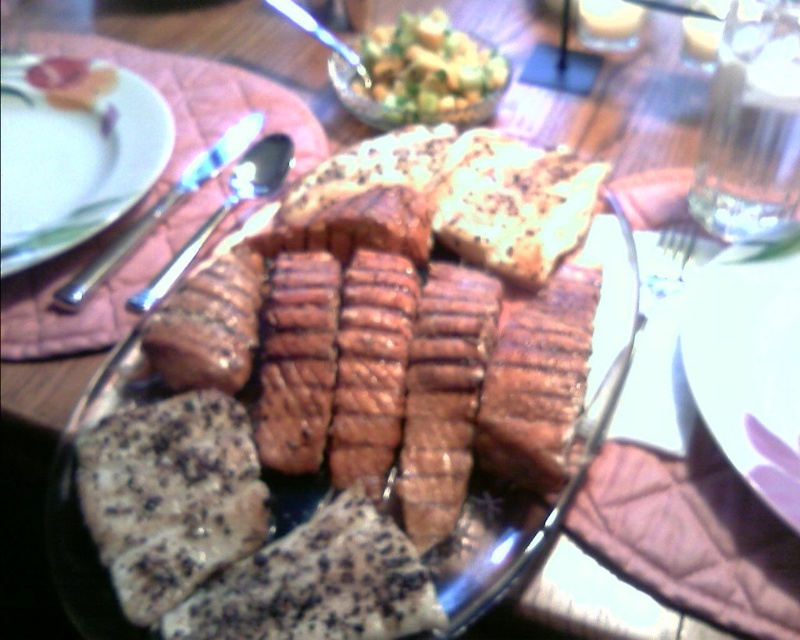
Which is more to the right, white glossy plate at center or satin silver knife at upper left?

white glossy plate at center is more to the right.

Does point (705, 305) come closer to viewer compared to point (210, 166)?

Yes, it is.

Image resolution: width=800 pixels, height=640 pixels. Describe the element at coordinates (750, 364) in the screenshot. I see `white glossy plate at center` at that location.

This screenshot has height=640, width=800. What are the coordinates of `white glossy plate at center` in the screenshot? It's located at (750, 364).

Where is `white glossy plate at center`? white glossy plate at center is located at coordinates (750, 364).

Who is more distant from viewer, (696, 376) or (432, 54)?

Positioned behind is point (432, 54).

At what (x,y) coordinates should I click in order to perform the action: click on white glossy plate at center. Please return your answer as a coordinate pair (x, y). The image size is (800, 640). Looking at the image, I should click on (750, 364).

Is green leafy salad at center below satin silver knife at upper left?

No, green leafy salad at center is not below satin silver knife at upper left.

Does green leafy salad at center have a smaller size compared to satin silver knife at upper left?

No.

What do you see at coordinates (428, 68) in the screenshot? I see `green leafy salad at center` at bounding box center [428, 68].

At what (x,y) coordinates should I click in order to perform the action: click on green leafy salad at center. Please return your answer as a coordinate pair (x, y). Looking at the image, I should click on (428, 68).